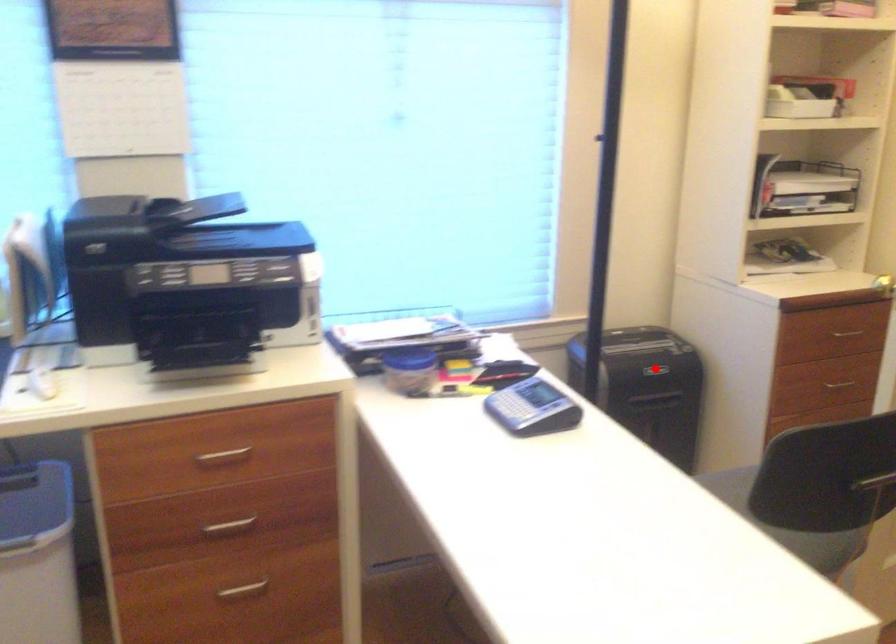
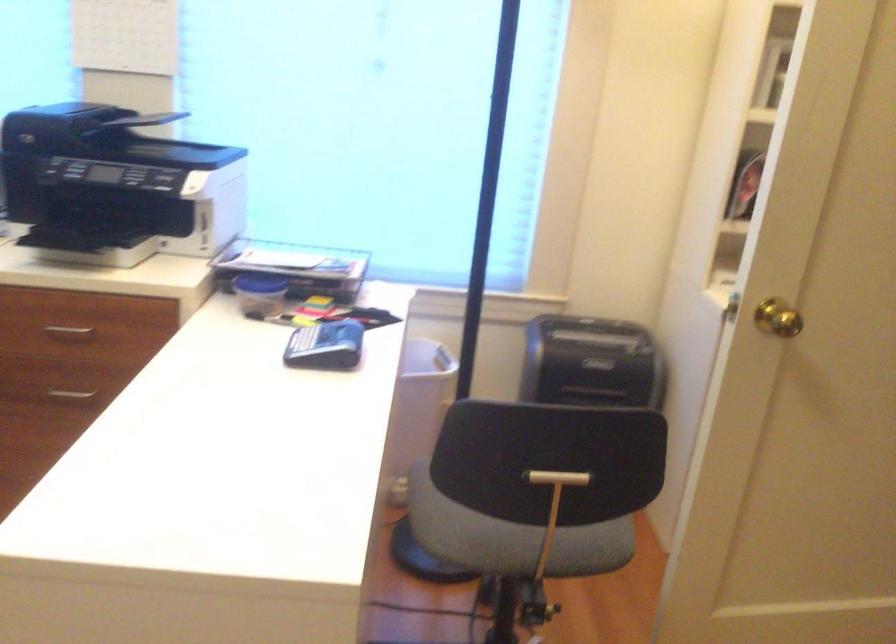
Locate, in the second image, the point that corresponds to the highlighted location in the first image.

(590, 363)